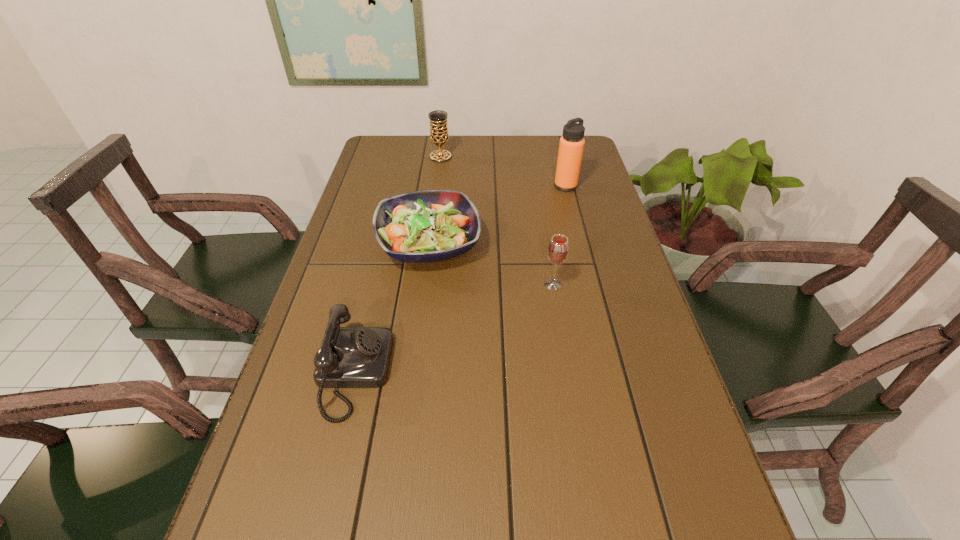
Identify the location of vacant space located 0.180m on the dial of the nearest object. Image resolution: width=960 pixels, height=540 pixels. (472, 373).

Locate an element on the screen. This screenshot has width=960, height=540. object present at the far edge is located at coordinates (439, 135).

Identify the location of salad plate that is at the left edge. Image resolution: width=960 pixels, height=540 pixels. (425, 226).

Identify the location of telephone that is positioned at the left edge. (349, 357).

You are a GUI agent. You are given a task and a screenshot of the screen. Output one action in this format:
    pyautogui.click(x=<x>, y=<y>)
    Task: Click on the object that is at the right edge
    The width and height of the screenshot is (960, 540).
    Given the screenshot: What is the action you would take?
    pyautogui.click(x=571, y=145)

In the image, there is a desktop. At what (x,y) coordinates should I click in order to perform the action: click on vacant space at the far edge. Please return your answer as a coordinate pair (x, y). Looking at the image, I should click on (541, 147).

Find the location of a particular element. Image resolution: width=960 pixels, height=540 pixels. vacant space at the left edge of the desktop is located at coordinates (x=360, y=192).

Locate an element on the screen. The height and width of the screenshot is (540, 960). free space at the right edge of the desktop is located at coordinates (671, 487).

This screenshot has width=960, height=540. Find the location of `vacant space at the far left corner of the desktop`. vacant space at the far left corner of the desktop is located at coordinates (377, 143).

You are a GUI agent. You are given a task and a screenshot of the screen. Output one action in this format:
    pyautogui.click(x=<x>, y=<y>)
    Task: Click on the vacant space that's between the fourth object from left to right and the chalice
    
    Given the screenshot: What is the action you would take?
    pyautogui.click(x=497, y=220)